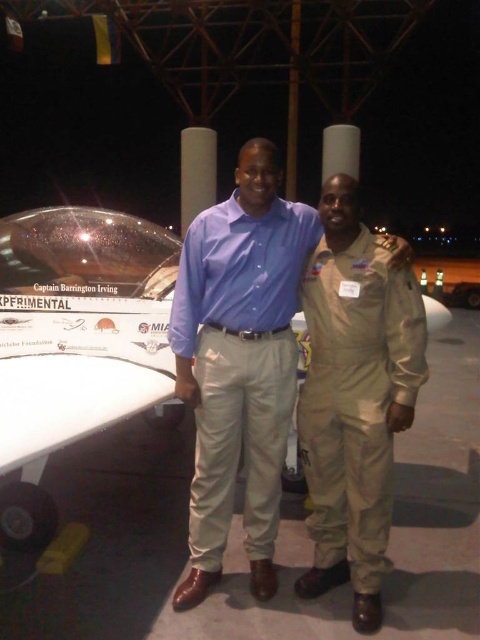
Can you confirm if white glossy airplane at center is positioned below matte blue shirt at center?

No, white glossy airplane at center is not below matte blue shirt at center.

Who is shorter, white glossy airplane at center or matte blue shirt at center?

white glossy airplane at center is shorter.

Is point (36, 419) farther from camera compared to point (256, 272)?

That is False.

Find the location of a particular element. The image size is (480, 640). white glossy airplane at center is located at coordinates (76, 342).

Who is shorter, matte blue shirt at center or tan/leather jumpsuit at center?

With less height is tan/leather jumpsuit at center.

Which is below, matte blue shirt at center or tan/leather jumpsuit at center?

tan/leather jumpsuit at center is below.

Is point (276, 250) closer to camera compared to point (354, 248)?

That is False.

The width and height of the screenshot is (480, 640). I want to click on matte blue shirt at center, so click(239, 362).

Is white glossy airplane at center wider than tan/leather jumpsuit at center?

Yes, white glossy airplane at center is wider than tan/leather jumpsuit at center.

Does white glossy airplane at center come behind tan/leather jumpsuit at center?

No, white glossy airplane at center is in front of tan/leather jumpsuit at center.

Is point (46, 440) closer to camera compared to point (321, 502)?

Yes, it is in front of point (321, 502).

The image size is (480, 640). In order to click on white glossy airplane at center in this screenshot , I will do `click(76, 342)`.